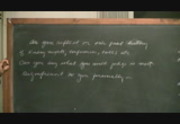
Where is `third line of writing on chalkboard`? This screenshot has width=180, height=124. third line of writing on chalkboard is located at coordinates (26, 61), (38, 62), (58, 63), (69, 62), (88, 64), (122, 62), (133, 63), (150, 64).